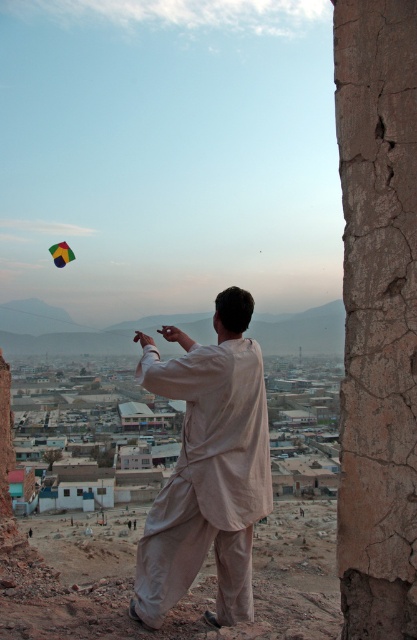
You are a photographer trying to capture the light beige cotton kurta at center and the multicolored fabric kite at upper left in the same frame. Based on their sizes, which one will appear larger in your photo?

The multicolored fabric kite at upper left will appear larger in the photo because the light beige cotton kurta at center is shorter than it.

You are a photographer trying to capture the perfect shot of the light beige cotton kurta at center. Based on the coordinates given, where should you position your camera to ensure the kurta is centered in the frame?

The light beige cotton kurta at center is located at coordinates point (208, 467), so positioning the camera to center the frame at those coordinates will ensure the kurta is centered.

You are a photographer trying to capture the light beige cotton kurta at center and the multicolored fabric kite at upper left in the same frame. Based on their positions, which object will appear larger in your photo?

The light beige cotton kurta at center will appear larger in the photo because it is closer to the viewer than the multicolored fabric kite at upper left.